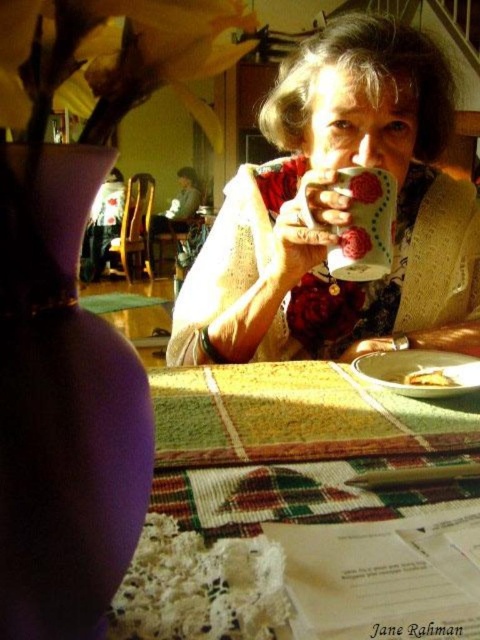
Question: Among these points, which one is farthest from the camera?

Choices:
 (A) (377, 211)
 (B) (118, 595)
 (C) (314, 305)
 (D) (60, 289)

Answer: (C)

Question: Can you confirm if yellow matte flower at upper left is smaller than lace fabric flower at lower left?

Choices:
 (A) no
 (B) yes

Answer: (A)

Question: Which point is closer to the camera?

Choices:
 (A) lace fabric flower at lower left
 (B) yellow matte flower at upper left
 (C) multicolored woven tablecloth at center
 (D) matte ceramic mug at center

Answer: (C)

Question: Does matte ceramic mug at upper center have a smaller size compared to matte floral cup at upper center?

Choices:
 (A) no
 (B) yes

Answer: (A)

Question: Which object is the farthest from the lace fabric flower at lower left?

Choices:
 (A) matte ceramic mug at center
 (B) matte ceramic mug at upper center

Answer: (B)

Question: Is matte ceramic mug at upper center to the right of purple matte vase at left from the viewer's perspective?

Choices:
 (A) yes
 (B) no

Answer: (A)